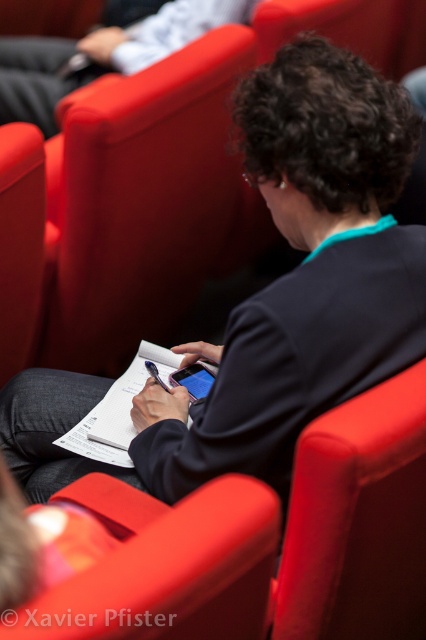
Question: Among these points, which one is farthest from the camera?

Choices:
 (A) (108, 557)
 (B) (155, 360)

Answer: (B)

Question: Which point appears farthest from the camera in this image?

Choices:
 (A) (218, 349)
 (B) (218, 525)

Answer: (A)

Question: Does matte red armchair at center have a smaller size compared to white paper at center?

Choices:
 (A) no
 (B) yes

Answer: (A)

Question: Which point is farther from the camera taking this photo?

Choices:
 (A) (135, 365)
 (B) (226, 522)
 (C) (146, 38)

Answer: (C)

Question: Can you confirm if matte black jacket at upper center is positioned above white paper at center?

Choices:
 (A) no
 (B) yes

Answer: (B)

Question: Does matte red armchair at center come behind white paper at center?

Choices:
 (A) yes
 (B) no

Answer: (B)